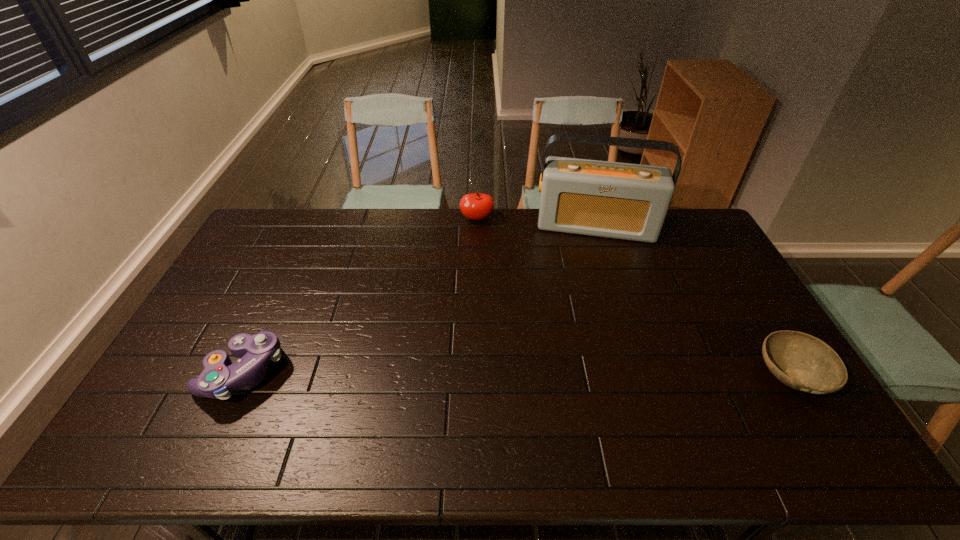
Where is `vacant space situated on the stem of the apple`? vacant space situated on the stem of the apple is located at coordinates (468, 274).

Image resolution: width=960 pixels, height=540 pixels. I want to click on free space located 0.090m on the stem of the apple, so click(x=473, y=241).

Image resolution: width=960 pixels, height=540 pixels. I want to click on free location located on the stem of the apple, so click(464, 299).

The width and height of the screenshot is (960, 540). I want to click on free region located 0.200m on the front-facing side of the second object from right to left, so click(588, 281).

Where is `vacant space situated 0.270m on the front-facing side of the second object from right to left`? vacant space situated 0.270m on the front-facing side of the second object from right to left is located at coordinates (588, 296).

Locate an element on the screen. blank area located 0.290m on the front-facing side of the second object from right to left is located at coordinates (588, 301).

Locate an element on the screen. This screenshot has width=960, height=540. apple at the far edge is located at coordinates (476, 206).

You are a GUI agent. You are given a task and a screenshot of the screen. Output one action in this format:
    pyautogui.click(x=<x>, y=<y>)
    Task: Click on the radio receiver that is at the far edge
    
    Given the screenshot: What is the action you would take?
    pyautogui.click(x=626, y=201)

Locate an element on the screen. control at the near edge is located at coordinates (220, 377).

I want to click on bowl that is at the near edge, so click(803, 362).